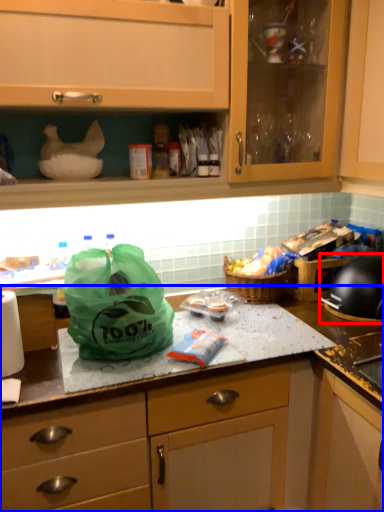
Question: Which object is closer to the camera taking this photo, kitchen appliance (highlighted by a red box) or countertop (highlighted by a blue box)?

Choices:
 (A) kitchen appliance
 (B) countertop

Answer: (B)